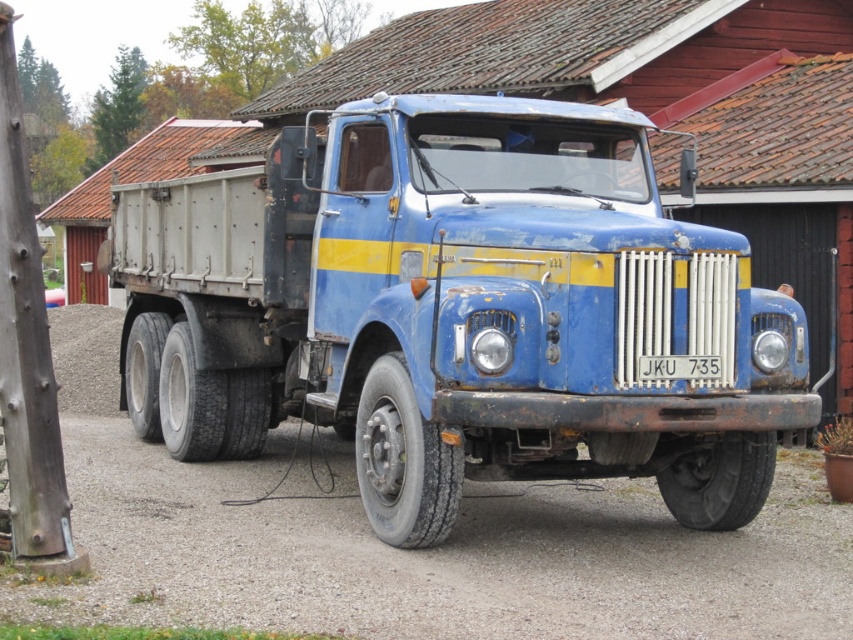
Can you confirm if rusty metal trailer truck at center is shorter than rusty metal dirt track at center?

Correct, rusty metal trailer truck at center is not as tall as rusty metal dirt track at center.

Can you confirm if rusty metal trailer truck at center is bigger than rusty metal dirt track at center?

Actually, rusty metal trailer truck at center might be smaller than rusty metal dirt track at center.

This screenshot has width=853, height=640. Identify the location of rusty metal trailer truck at center. (459, 310).